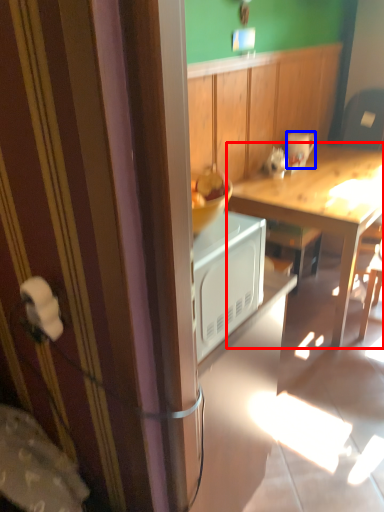
Question: Which object appears closest to the camera in this image, desk (highlighted by a red box) or coffee cup (highlighted by a blue box)?

Choices:
 (A) desk
 (B) coffee cup

Answer: (A)